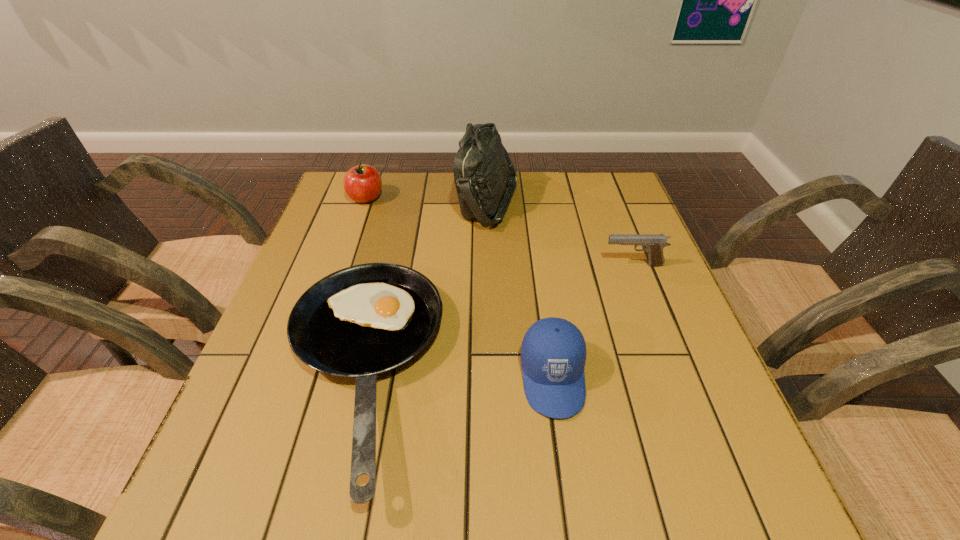
At what (x,y) coordinates should I click in order to perform the action: click on the tallest object. Please return your answer as a coordinate pair (x, y). The height and width of the screenshot is (540, 960). Looking at the image, I should click on (483, 169).

Locate an element on the screen. This screenshot has height=540, width=960. apple is located at coordinates (362, 183).

Find the location of a particular element. Image resolution: width=960 pixels, height=540 pixels. cap is located at coordinates (553, 353).

Find the location of `pistol`. pistol is located at coordinates (653, 244).

The height and width of the screenshot is (540, 960). What are the coordinates of `the rightmost object` in the screenshot? It's located at (653, 244).

Identify the location of frying pan. The image size is (960, 540). click(364, 320).

I want to click on vacant region located at the front padded panel of the shoulder bag, so click(361, 202).

The height and width of the screenshot is (540, 960). In order to click on vacant point located at the front padded panel of the shoulder bag in this screenshot , I will do `click(368, 202)`.

Where is `free space located at the front padded panel of the shoulder bag`? The width and height of the screenshot is (960, 540). free space located at the front padded panel of the shoulder bag is located at coordinates (371, 202).

Locate an element on the screen. The height and width of the screenshot is (540, 960). free space located 0.090m on the back of the apple is located at coordinates (374, 173).